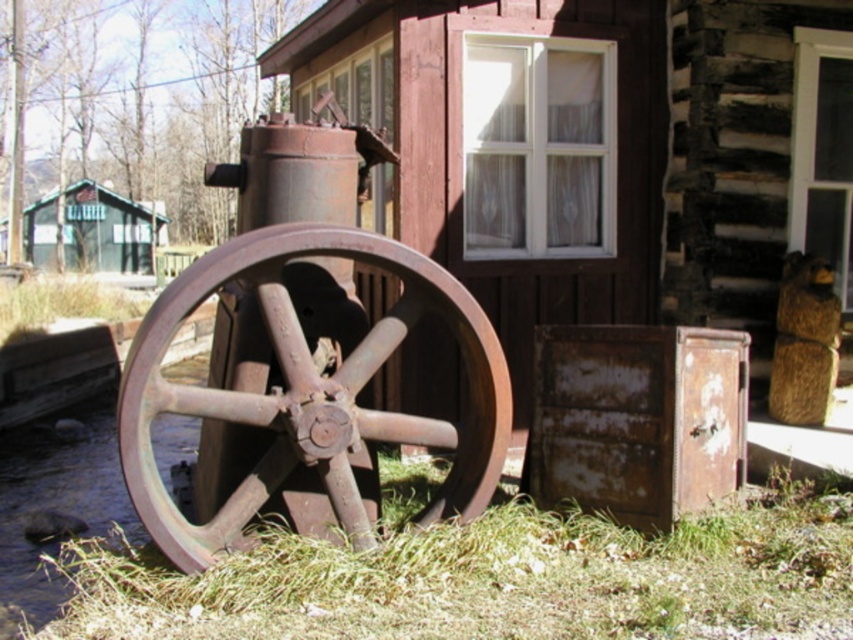
Is green grass at lower center taller than green wood cabin at left?

Result: Incorrect, green grass at lower center's height is not larger of green wood cabin at left's.

Does green grass at lower center appear over green wood cabin at left?

Incorrect, green grass at lower center is not positioned above green wood cabin at left.

Which is in front, point (44, 634) or point (96, 184)?

Positioned in front is point (44, 634).

Where is `green grass at lower center`? green grass at lower center is located at coordinates (494, 577).

Is rusty wood cabin at center taller than green grass at lower center?

Yes.

This screenshot has width=853, height=640. What do you see at coordinates (577, 148) in the screenshot?
I see `rusty wood cabin at center` at bounding box center [577, 148].

The height and width of the screenshot is (640, 853). What are the coordinates of `rusty wood cabin at center` in the screenshot? It's located at (577, 148).

Looking at this image, can you confirm if rusty wood cabin at center is taller than green wood cabin at left?

Correct, rusty wood cabin at center is much taller as green wood cabin at left.

Is rusty wood cabin at center wider than green wood cabin at left?

Yes, rusty wood cabin at center is wider than green wood cabin at left.

Which is behind, point (614, 227) or point (120, 252)?

Point (120, 252)

In order to click on rusty wood cabin at center in this screenshot , I will do `click(577, 148)`.